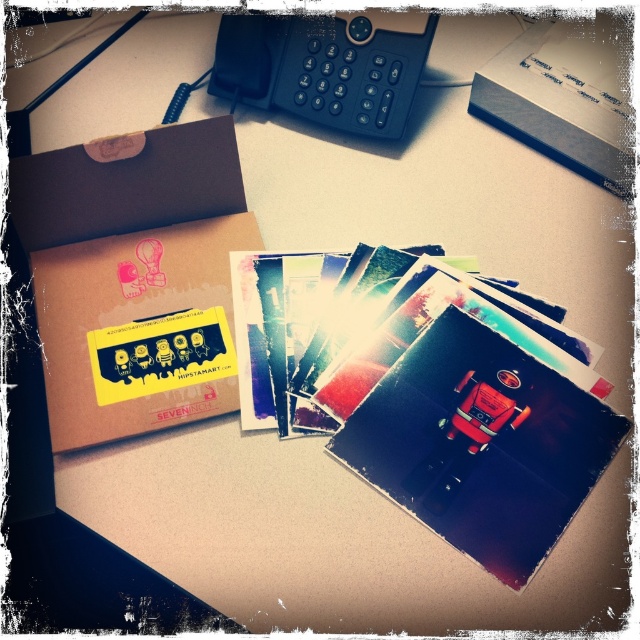
You are organizing items on the desk and need to move the brown cardboard box at upper left and the white cardboard box at upper center. Which box should you move first if you want to access the one behind it?

You should move the brown cardboard box at upper left first because it is in front of the white cardboard box at upper center, so moving it will allow access to the box behind.

You are organizing items on the desk and need to place the brown cardboard box at upper left and the black plastic phone at upper center. If you want to move the phone to a position behind the box, is that possible based on their current arrangement?

The brown cardboard box at upper left is already in front of the black plastic phone at upper center, so moving the phone behind the box would not change their relative positions. However, if you move the phone to be behind the box, it would then be positioned behind the box, which is possible as they can be rearranged.

You are a delivery person who needs to place a package on the desk. The package is 22 inches long. There is a spot marked at point (132, 384). Can the package fit from the edge of the desk to this point?

The distance from the edge of the desk to the point (132, 384) is 22.44 inches. Since the package is 22 inches long, it can fit within that space.